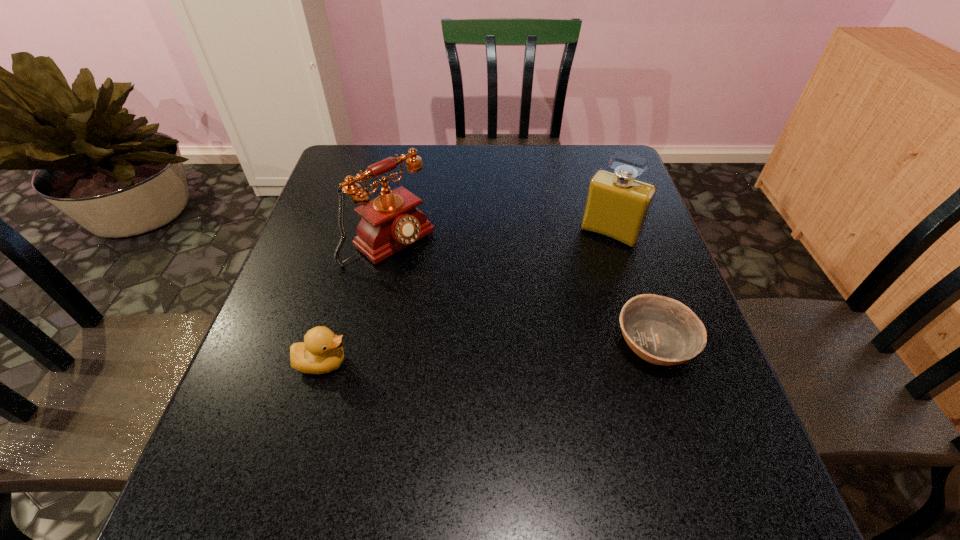
At what (x,y) coordinates should I click in order to perform the action: click on free space on the desktop that is between the third tallest object and the shortest object and is positioned on the front-facing side of the perfume. Please return your answer as a coordinate pair (x, y). The height and width of the screenshot is (540, 960). Looking at the image, I should click on (538, 349).

You are a GUI agent. You are given a task and a screenshot of the screen. Output one action in this format:
    pyautogui.click(x=<x>, y=<y>)
    Task: Click on the vacant space on the desktop that is between the duckling and the shortest object and is positioned on the dial of the telephone
    
    Given the screenshot: What is the action you would take?
    pyautogui.click(x=521, y=350)